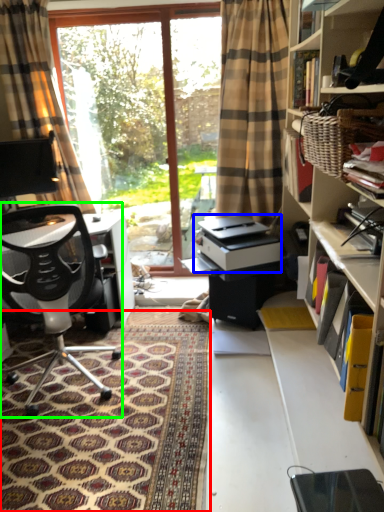
Question: Based on their relative distances, which object is farther from mat (highlighted by a red box)? Choose from printer (highlighted by a blue box) and chair (highlighted by a green box).

Choices:
 (A) printer
 (B) chair

Answer: (A)